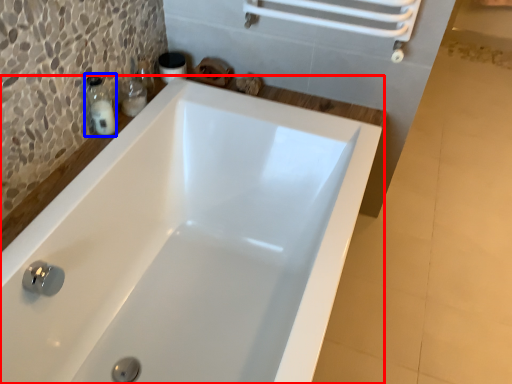
Question: Which object appears closest to the camera in this image, bathtub (highlighted by a red box) or soap dispenser (highlighted by a blue box)?

Choices:
 (A) bathtub
 (B) soap dispenser

Answer: (A)